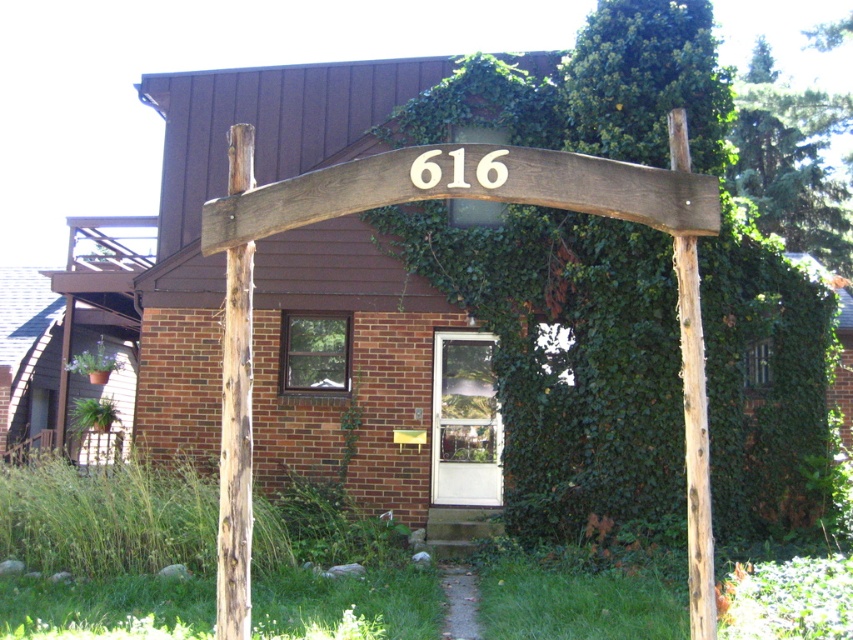
Question: Which point is closer to the camera taking this photo?

Choices:
 (A) (695, 275)
 (B) (241, 364)

Answer: (A)

Question: Is rough wooden post at center smaller than brown rough wood post at right?

Choices:
 (A) yes
 (B) no

Answer: (B)

Question: Is rough wooden post at center wider than brown rough wood post at right?

Choices:
 (A) no
 (B) yes

Answer: (B)

Question: Does rough wooden post at center have a greater width compared to brown rough wood post at right?

Choices:
 (A) no
 (B) yes

Answer: (B)

Question: Which point is closer to the camera?

Choices:
 (A) (709, 529)
 (B) (218, 612)

Answer: (A)

Question: Which point is farther to the camera?

Choices:
 (A) brown rough wood post at right
 (B) rough wooden post at center

Answer: (B)